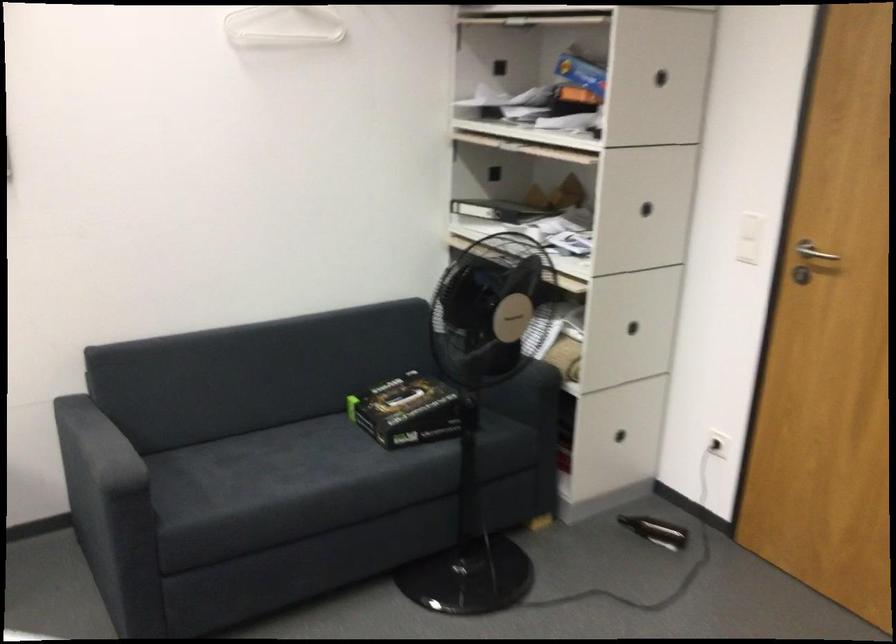
This screenshot has height=644, width=896. Describe the element at coordinates (748, 238) in the screenshot. I see `the white light switch` at that location.